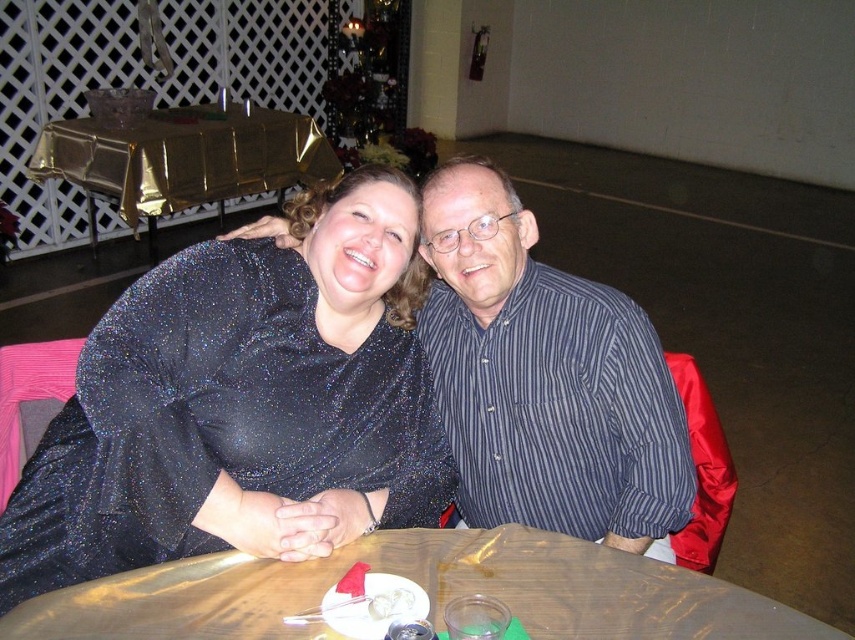
Is sparkly black dress at center below white creamy dessert at table?

Incorrect, sparkly black dress at center is not positioned below white creamy dessert at table.

Who is taller, sparkly black dress at center or white creamy dessert at table?

sparkly black dress at center is taller.

Between point (80, 380) and point (399, 602), which one is positioned in front?

Point (399, 602)

You are a GUI agent. You are given a task and a screenshot of the screen. Output one action in this format:
    pyautogui.click(x=<x>, y=<y>)
    Task: Click on the sparkly black dress at center
    The image size is (855, 640).
    Given the screenshot: What is the action you would take?
    pyautogui.click(x=243, y=403)

Is striped cotton shirt at center wider than gold plastic table at center?

Incorrect, striped cotton shirt at center's width does not surpass gold plastic table at center's.

Is point (612, 392) behind point (635, 579)?

Yes, it is.

In order to click on striped cotton shirt at center in this screenshot , I will do `click(545, 378)`.

Based on the photo, between sparkly black dress at center and gold plastic table at center, which one is positioned lower?

gold plastic table at center is lower down.

Who is higher up, sparkly black dress at center or gold plastic table at center?

sparkly black dress at center

Which is in front, point (86, 481) or point (416, 531)?

Point (86, 481) is in front.

Image resolution: width=855 pixels, height=640 pixels. I want to click on sparkly black dress at center, so click(243, 403).